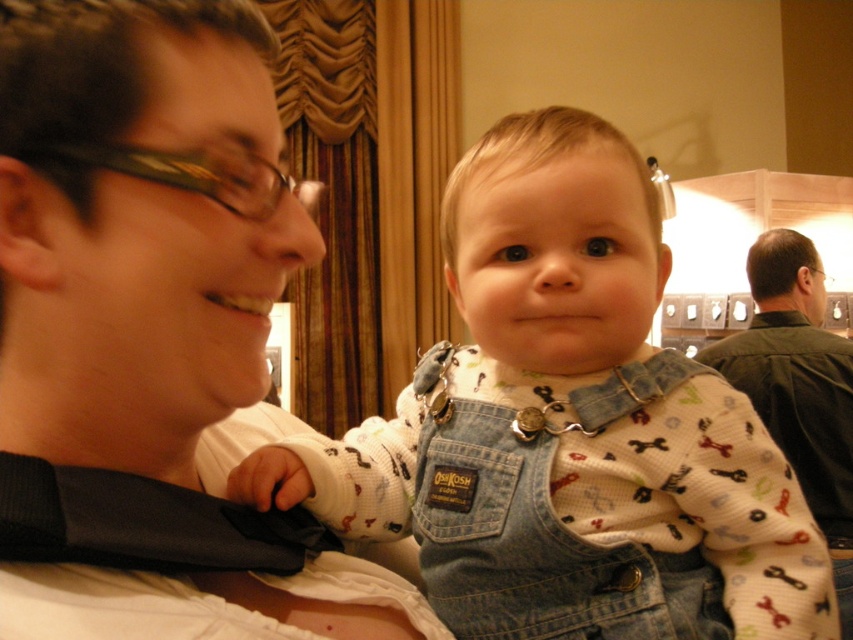
Consider the image. Between denim overalls at center and green cotton shirt at upper right, which one has less height?

With less height is denim overalls at center.

Who is taller, denim overalls at center or green cotton shirt at upper right?

With more height is green cotton shirt at upper right.

Which is in front, point (517, 170) or point (772, 413)?

Point (517, 170) is in front.

Image resolution: width=853 pixels, height=640 pixels. What are the coordinates of `denim overalls at center` in the screenshot? It's located at (567, 428).

Describe the element at coordinates (151, 321) in the screenshot. I see `matte black tie at left` at that location.

Between matte black tie at left and green cotton shirt at upper right, which one appears on the left side from the viewer's perspective?

From the viewer's perspective, matte black tie at left appears more on the left side.

Does point (136, 433) come farther from viewer compared to point (744, 356)?

No, it is not.

Identify the location of matte black tie at left. The width and height of the screenshot is (853, 640). (151, 321).

Does matte black tie at left have a greater height compared to denim overalls at center?

No, matte black tie at left is not taller than denim overalls at center.

I want to click on matte black tie at left, so click(x=151, y=321).